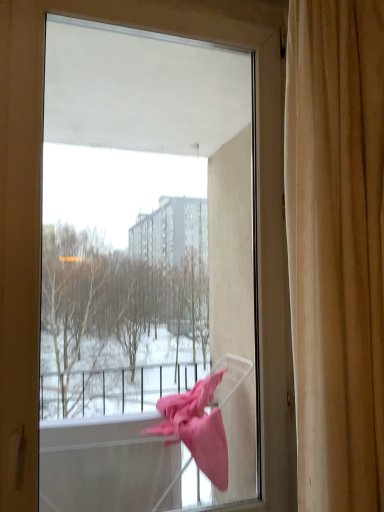
Question: Considering the relative sizes of transparent plastic basket at lower right and beige fabric curtain at right in the image provided, is transparent plastic basket at lower right bigger than beige fabric curtain at right?

Choices:
 (A) yes
 (B) no

Answer: (A)

Question: Is transparent plastic basket at lower right wider than beige fabric curtain at right?

Choices:
 (A) yes
 (B) no

Answer: (B)

Question: Is transparent plastic basket at lower right aimed at beige fabric curtain at right?

Choices:
 (A) no
 (B) yes

Answer: (B)

Question: Is transparent plastic basket at lower right surrounding beige fabric curtain at right?

Choices:
 (A) no
 (B) yes

Answer: (A)

Question: Can you confirm if transparent plastic basket at lower right is thinner than beige fabric curtain at right?

Choices:
 (A) yes
 (B) no

Answer: (A)

Question: From the image's perspective, would you say transparent plastic basket at lower right is shown under beige fabric curtain at right?

Choices:
 (A) yes
 (B) no

Answer: (A)

Question: Can you confirm if beige fabric curtain at right is smaller than transparent plastic basket at lower right?

Choices:
 (A) no
 (B) yes

Answer: (B)

Question: From the image's perspective, would you say beige fabric curtain at right is shown under transparent plastic basket at lower right?

Choices:
 (A) no
 (B) yes

Answer: (A)

Question: Is the position of beige fabric curtain at right more distant than that of transparent plastic basket at lower right?

Choices:
 (A) no
 (B) yes

Answer: (A)

Question: From the image's perspective, would you say beige fabric curtain at right is positioned over transparent plastic basket at lower right?

Choices:
 (A) no
 (B) yes

Answer: (B)

Question: Is beige fabric curtain at right next to transparent plastic basket at lower right and touching it?

Choices:
 (A) yes
 (B) no

Answer: (B)

Question: Considering the relative sizes of beige fabric curtain at right and transparent plastic basket at lower right in the image provided, is beige fabric curtain at right thinner than transparent plastic basket at lower right?

Choices:
 (A) yes
 (B) no

Answer: (B)

Question: From the image's perspective, is beige fabric curtain at right located above or below transparent plastic basket at lower right?

Choices:
 (A) above
 (B) below

Answer: (A)